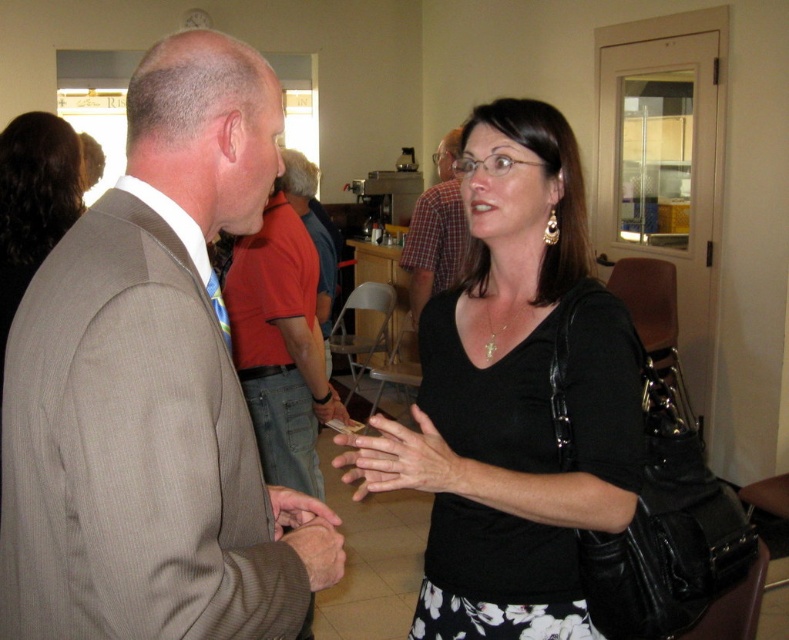
Question: Considering the relative positions of light brown suit at center and plaid shirt at center in the image provided, where is light brown suit at center located with respect to plaid shirt at center?

Choices:
 (A) left
 (B) right

Answer: (A)

Question: Which object is positioned closest to the black matte shirt at center?

Choices:
 (A) plaid shirt at center
 (B) light brown suit at center

Answer: (B)

Question: Based on their relative distances, which object is nearer to the black matte shirt at center?

Choices:
 (A) light brown suit at center
 (B) plaid shirt at center

Answer: (A)

Question: Where is black matte shirt at center located in relation to plaid shirt at center in the image?

Choices:
 (A) left
 (B) right

Answer: (B)

Question: Which of these objects is positioned farthest from the light brown suit at center?

Choices:
 (A) black matte shirt at center
 (B) plaid shirt at center

Answer: (B)

Question: Does light brown suit at center have a smaller size compared to black matte shirt at center?

Choices:
 (A) no
 (B) yes

Answer: (B)